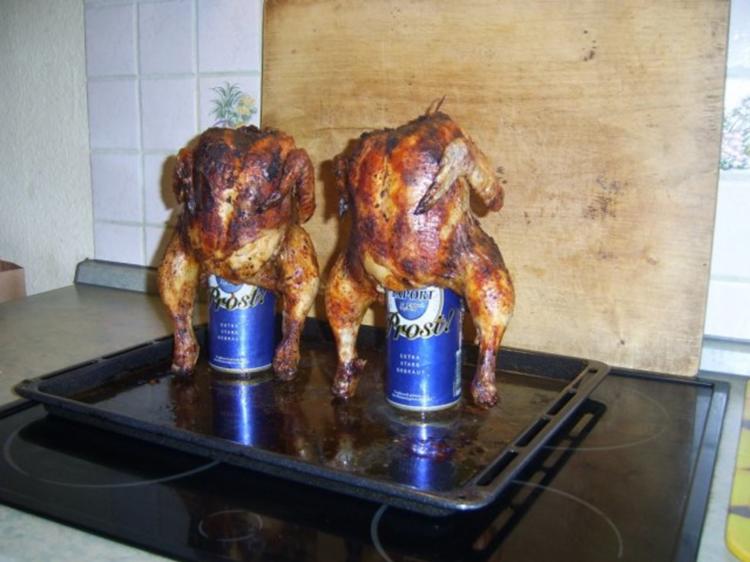
Locate an element on the screen. The height and width of the screenshot is (562, 750). wall is located at coordinates (92, 140).